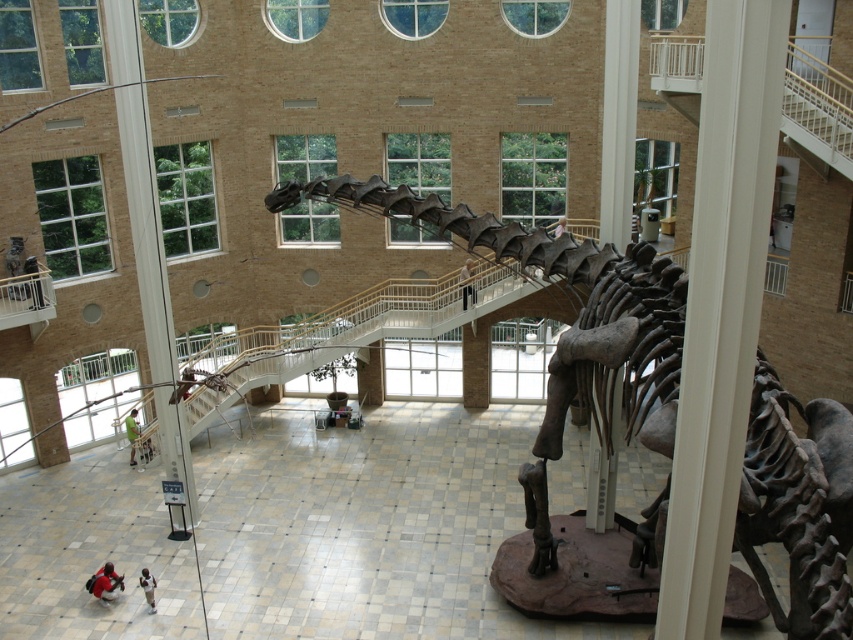
Can you confirm if gray bone-like skeleton at center is positioned to the right of black fabric pants at center?

Indeed, gray bone-like skeleton at center is positioned on the right side of black fabric pants at center.

Which of these two, gray bone-like skeleton at center or black fabric pants at center, stands taller?

gray bone-like skeleton at center is taller.

Between point (677, 392) and point (469, 291), which one is positioned behind?

Positioned behind is point (469, 291).

You are a GUI agent. You are given a task and a screenshot of the screen. Output one action in this format:
    pyautogui.click(x=<x>, y=<y>)
    Task: Click on the gray bone-like skeleton at center
    This screenshot has height=640, width=853.
    Given the screenshot: What is the action you would take?
    pyautogui.click(x=572, y=324)

Can you confirm if gray bone-like skeleton at center is taller than white cotton shirt at lower left?

Yes, gray bone-like skeleton at center is taller than white cotton shirt at lower left.

Does point (666, 387) come closer to viewer compared to point (102, 589)?

That is True.

Identify the location of gray bone-like skeleton at center. The height and width of the screenshot is (640, 853). (572, 324).

Is gray bone-like skeleton at center thinner than white cotton pants at lower left?

No.

Looking at this image, can you confirm if gray bone-like skeleton at center is positioned to the left of white cotton pants at lower left?

No, gray bone-like skeleton at center is not to the left of white cotton pants at lower left.

Find the location of `gray bone-like skeleton at center`. gray bone-like skeleton at center is located at coordinates (572, 324).

Find the location of a particular element. gray bone-like skeleton at center is located at coordinates (572, 324).